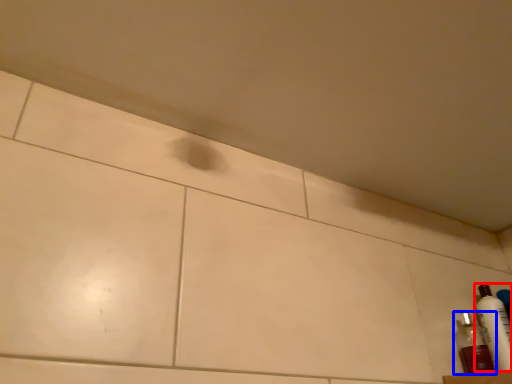
Question: Among these objects, which one is nearest to the camera, bottle (highlighted by a red box) or bottle (highlighted by a blue box)?

Choices:
 (A) bottle
 (B) bottle

Answer: (B)